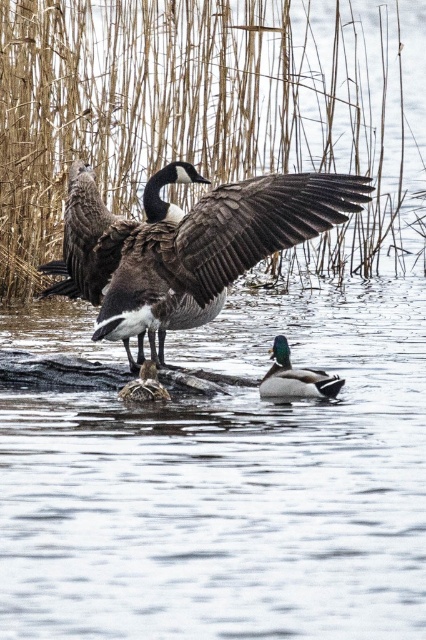
Question: Is brown feathered goose at center above brown fuzzy duckling at center?

Choices:
 (A) no
 (B) yes

Answer: (B)

Question: Does dark brown feathered wing at center appear under green glossy duck at center?

Choices:
 (A) no
 (B) yes

Answer: (A)

Question: Is brown textured reed at center bigger than brown feathered goose at center?

Choices:
 (A) no
 (B) yes

Answer: (B)

Question: Among these points, which one is nearest to the camera?

Choices:
 (A) (304, 369)
 (B) (183, 278)

Answer: (B)

Question: Which of the following is the farthest from the observer?

Choices:
 (A) (287, 346)
 (B) (258, 253)
 (C) (250, 237)
 (D) (138, 380)

Answer: (A)

Question: Which of the following is the farthest from the observer?

Choices:
 (A) (218, 294)
 (B) (132, 397)
 (C) (307, 252)

Answer: (C)